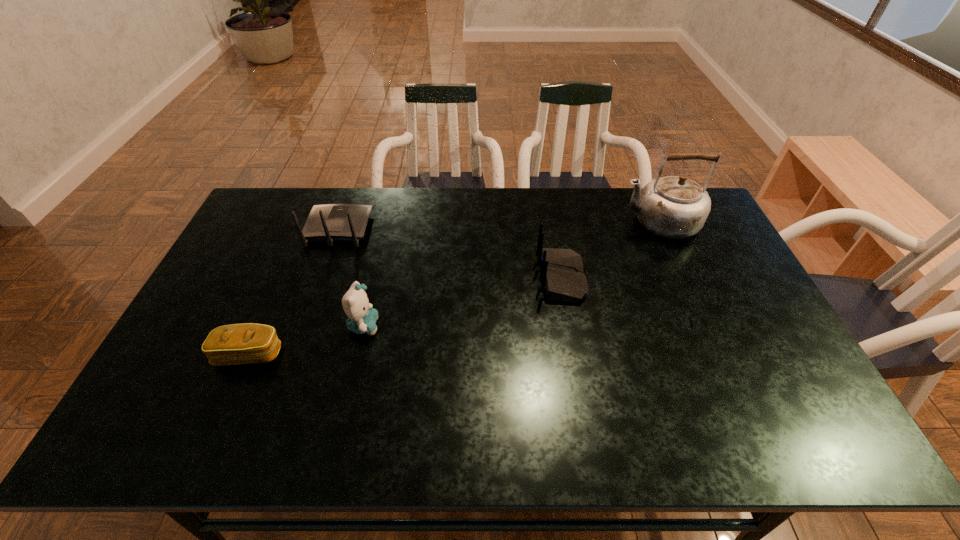
At what (x,y) coordinates should I click in order to perform the action: click on object that is positioned at the right edge. Please return your answer as a coordinate pair (x, y). This screenshot has height=540, width=960. Looking at the image, I should click on (675, 207).

Locate an element on the screen. object present at the far right corner is located at coordinates [675, 207].

In the image, there is a desktop. At what (x,y) coordinates should I click in order to perform the action: click on vacant space at the far edge. Please return your answer as a coordinate pair (x, y). This screenshot has height=540, width=960. Looking at the image, I should click on (637, 227).

Find the location of a particular element. blank space at the near edge of the desktop is located at coordinates (643, 443).

Identify the location of vacant region at the far left corner of the desktop. This screenshot has height=540, width=960. (301, 207).

Where is `vacant space at the near left corner`? This screenshot has width=960, height=540. vacant space at the near left corner is located at coordinates (176, 424).

In the image, there is a desktop. Identify the location of vacant area at the far right corner. (704, 230).

Find the location of a particular element. This screenshot has width=960, height=540. free space between the tallest object and the nearer router is located at coordinates (610, 250).

The height and width of the screenshot is (540, 960). Find the location of `vacant area that lies between the third object from right to left and the shortest object`. vacant area that lies between the third object from right to left and the shortest object is located at coordinates (306, 340).

The height and width of the screenshot is (540, 960). Identify the location of free space between the shortest object and the third object from left to right. (306, 340).